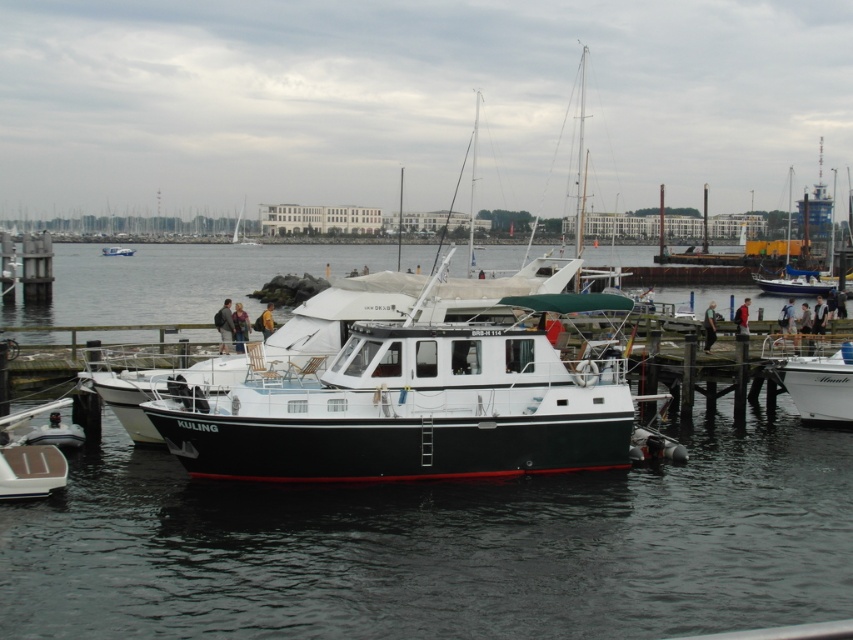
You are standing on the wooden dock where the black and white motorboat named KULING is moored. You notice a point marked at coordinates (814, 378). Based on the scene, which object does this point belong to?

The point at coordinates (814, 378) is on the white glossy boat at right.

You are a photographer planning to take a wide shot of the marina scene. You want to ensure that both the black glossy water at center and the white glossy boat at right are clearly visible in your composition. Based on their heights, which object will appear taller in the photo?

The black glossy water at center will appear taller in the photo since it has a greater height compared to the white glossy boat at right according to the description.